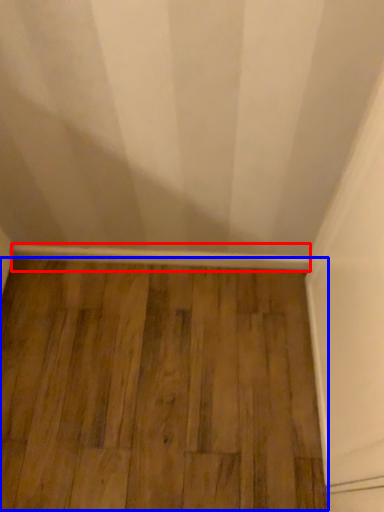
Question: Which object appears farthest to the camera in this image, molding (highlighted by a red box) or hardwood (highlighted by a blue box)?

Choices:
 (A) molding
 (B) hardwood

Answer: (A)